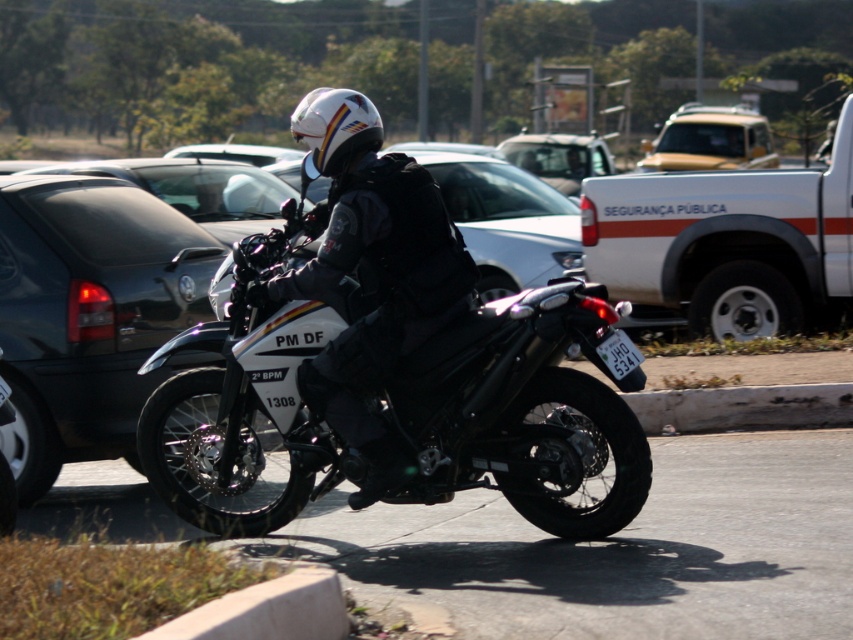
You are a driver approaching an intersection and see a white matte ambulance at center and a black plastic license plate at center. Which object is located to the right of the other?

The white matte ambulance at center is positioned on the right side of black plastic license plate at center.

You are a photographer trying to capture a clear shot of the black plastic license plate at center without the white matte ambulance at center blocking it. Is the ambulance large enough to obstruct the license plate in your view?

The white matte ambulance at center is larger in size compared to the black plastic license plate at center, so yes, the ambulance could potentially block the license plate from view.

You are a delivery person who needs to park your vehicle in the parking lot shown in the image. There is a point marked at coordinates (524, 412). What object is located at that point?

The metallic black motorcycle at center is located at point (524, 412).